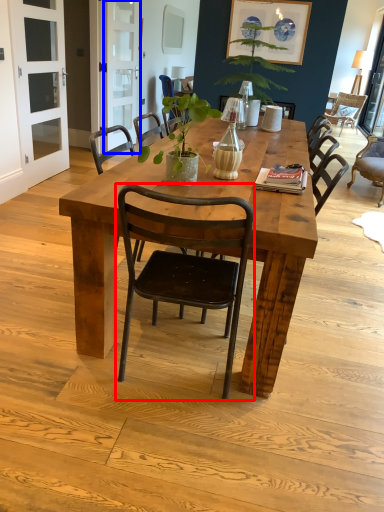
Question: Which of the following is the farthest to the observer, chair (highlighted by a red box) or screen door (highlighted by a blue box)?

Choices:
 (A) chair
 (B) screen door

Answer: (B)